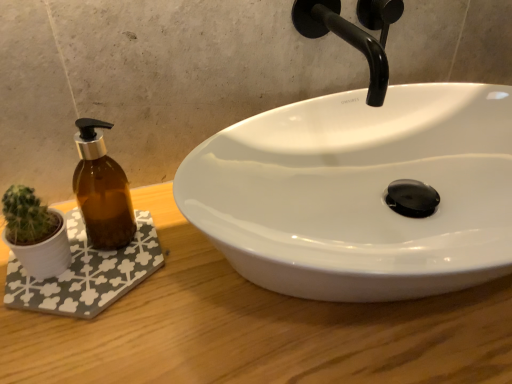
Question: Can you confirm if white glossy sink at center is taller than white fabric bath mat at lower left?

Choices:
 (A) yes
 (B) no

Answer: (A)

Question: Is white glossy sink at center touching white fabric bath mat at lower left?

Choices:
 (A) yes
 (B) no

Answer: (B)

Question: Can you confirm if white glossy sink at center is thinner than white fabric bath mat at lower left?

Choices:
 (A) yes
 (B) no

Answer: (B)

Question: From the image's perspective, does white glossy sink at center appear lower than white fabric bath mat at lower left?

Choices:
 (A) no
 (B) yes

Answer: (A)

Question: Is white glossy sink at center bigger than white fabric bath mat at lower left?

Choices:
 (A) yes
 (B) no

Answer: (A)

Question: In terms of size, does white fabric bath mat at lower left appear bigger or smaller than wooden counter at center?

Choices:
 (A) small
 (B) big

Answer: (A)

Question: Would you say white fabric bath mat at lower left is inside or outside wooden counter at center?

Choices:
 (A) inside
 (B) outside

Answer: (A)

Question: Is white fabric bath mat at lower left taller or shorter than wooden counter at center?

Choices:
 (A) short
 (B) tall

Answer: (A)

Question: From the image's perspective, is white fabric bath mat at lower left above or below wooden counter at center?

Choices:
 (A) above
 (B) below

Answer: (A)

Question: From the image's perspective, relative to white fabric bath mat at lower left, is white glossy sink at center above or below?

Choices:
 (A) below
 (B) above

Answer: (B)

Question: From their relative heights in the image, would you say white glossy sink at center is taller or shorter than white fabric bath mat at lower left?

Choices:
 (A) short
 (B) tall

Answer: (B)

Question: Is white glossy sink at center spatially inside white fabric bath mat at lower left, or outside of it?

Choices:
 (A) inside
 (B) outside

Answer: (B)

Question: Based on their positions, is white glossy sink at center located to the left or right of white fabric bath mat at lower left?

Choices:
 (A) right
 (B) left

Answer: (A)

Question: Looking at the image, does wooden counter at center seem bigger or smaller compared to white fabric bath mat at lower left?

Choices:
 (A) small
 (B) big

Answer: (B)

Question: From a real-world perspective, is wooden counter at center above or below white fabric bath mat at lower left?

Choices:
 (A) above
 (B) below

Answer: (B)